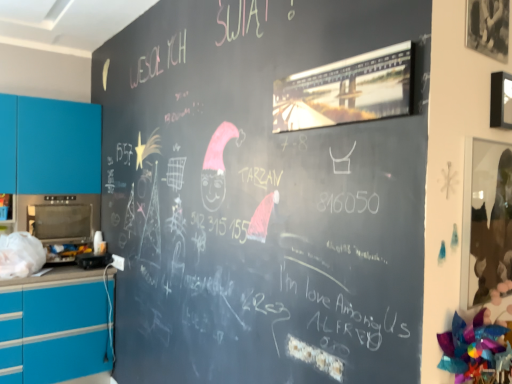
Question: Is black plastic toaster at lower left, the first appliance positioned from the bottom, outside matte blue cabinet at left?

Choices:
 (A) yes
 (B) no

Answer: (A)

Question: From the image's perspective, is black plastic toaster at lower left, the second appliance positioned from the left, on matte blue cabinet at left?

Choices:
 (A) no
 (B) yes

Answer: (A)

Question: Is black plastic toaster at lower left, the 1th appliance positioned from the right, not near matte blue cabinet at left?

Choices:
 (A) no
 (B) yes

Answer: (A)

Question: Can you confirm if black plastic toaster at lower left, the second appliance positioned from the left, is smaller than matte blue cabinet at left?

Choices:
 (A) yes
 (B) no

Answer: (A)

Question: Can you confirm if black plastic toaster at lower left, the second appliance positioned from the left, is positioned to the right of matte blue cabinet at left?

Choices:
 (A) no
 (B) yes

Answer: (B)

Question: Do you think metallic oven at left, the 1th appliance when ordered from left to right, is within matte blue cabinet at left, or outside of it?

Choices:
 (A) outside
 (B) inside

Answer: (B)

Question: Is metallic oven at left, which is counted as the 1th appliance, starting from the top, to the left or to the right of matte blue cabinet at left in the image?

Choices:
 (A) left
 (B) right

Answer: (B)

Question: From a real-world perspective, is metallic oven at left, the 1th appliance when ordered from left to right, above or below matte blue cabinet at left?

Choices:
 (A) below
 (B) above

Answer: (A)

Question: In terms of size, does metallic oven at left, which is the 2th appliance from bottom to top, appear bigger or smaller than matte blue cabinet at left?

Choices:
 (A) small
 (B) big

Answer: (A)

Question: In the image, is black plastic toaster at lower left, which appears as the 2th appliance when viewed from the top, positioned in front of or behind matte blue cabinet at left?

Choices:
 (A) behind
 (B) front

Answer: (B)

Question: Based on their positions, is black plastic toaster at lower left, the 1th appliance positioned from the right, located to the left or right of matte blue cabinet at left?

Choices:
 (A) left
 (B) right

Answer: (B)

Question: From a real-world perspective, relative to matte blue cabinet at left, is black plastic toaster at lower left, the 1th appliance positioned from the right, vertically above or below?

Choices:
 (A) above
 (B) below

Answer: (B)

Question: Considering the positions of black plastic toaster at lower left, the 1th appliance positioned from the right, and matte blue cabinet at left in the image, is black plastic toaster at lower left, the 1th appliance positioned from the right, wider or thinner than matte blue cabinet at left?

Choices:
 (A) thin
 (B) wide

Answer: (A)

Question: Would you say metallic oven at left, which is counted as the 1th appliance, starting from the top, is inside or outside black plastic toaster at lower left, the first appliance positioned from the bottom?

Choices:
 (A) outside
 (B) inside

Answer: (A)

Question: Is metallic oven at left, which is counted as the 1th appliance, starting from the top, bigger or smaller than black plastic toaster at lower left, the 1th appliance positioned from the right?

Choices:
 (A) small
 (B) big

Answer: (B)